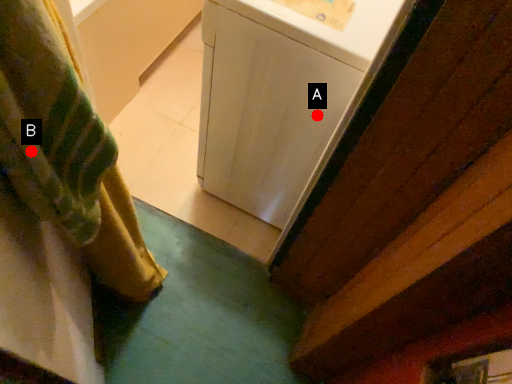
Question: Two points are circled on the image, labeled by A and B beside each circle. Which point is closer to the camera?

Choices:
 (A) A is closer
 (B) B is closer

Answer: (B)